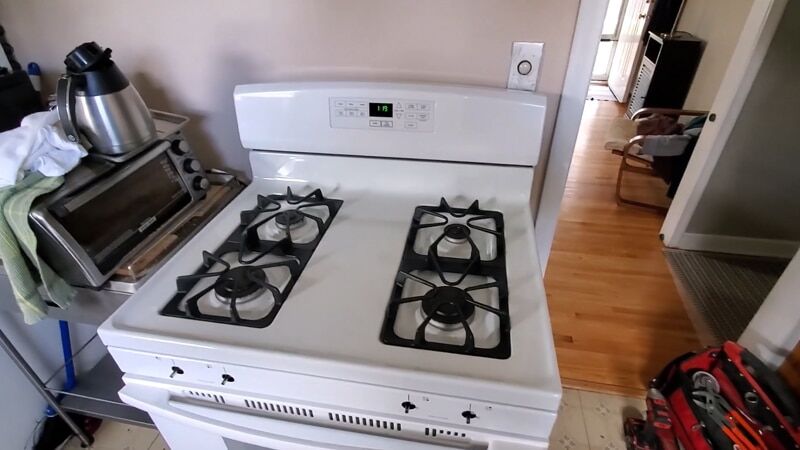
The width and height of the screenshot is (800, 450). In order to click on doorway in this screenshot , I will do `click(581, 89)`, `click(734, 100)`.